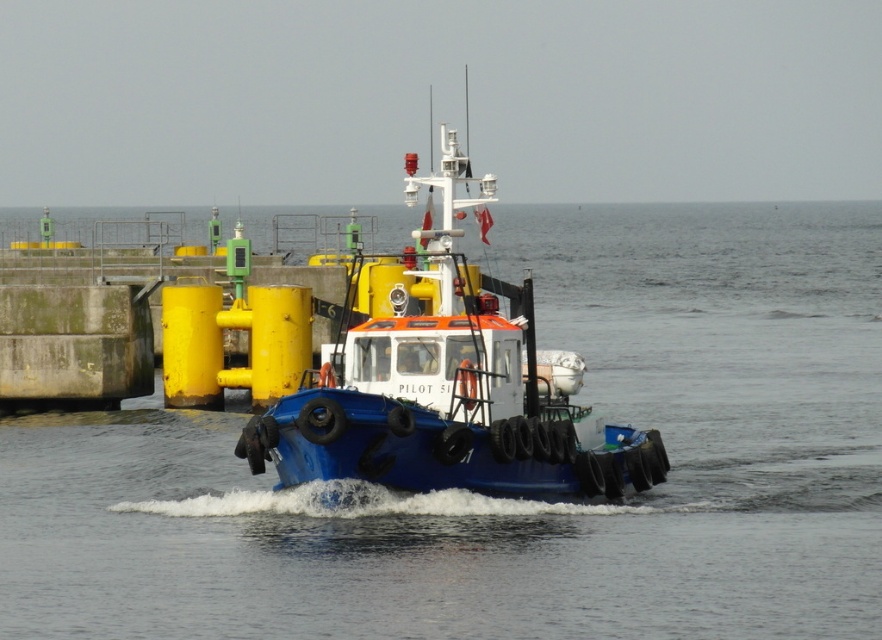
Consider the image. You are standing on the deck of the pilot boat and looking around. Where exactly is the blue water at center located in terms of coordinates?

The blue water at center is located at point coordinates of (509, 499).

You are on the pilot boat and want to determine the distance between two points marked on your navigation screen. The points are labeled as point (871, 308) and point (423, 369). Which point is closer to you, the observer, on the screen?

Point (423, 369) is closer to you because it is nearer to the camera compared to point (871, 308), which is further away.